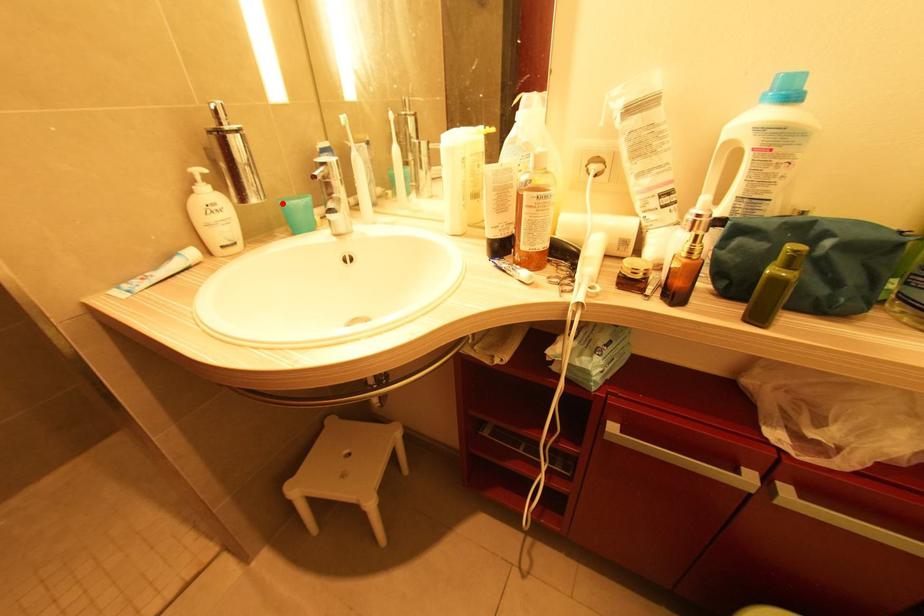
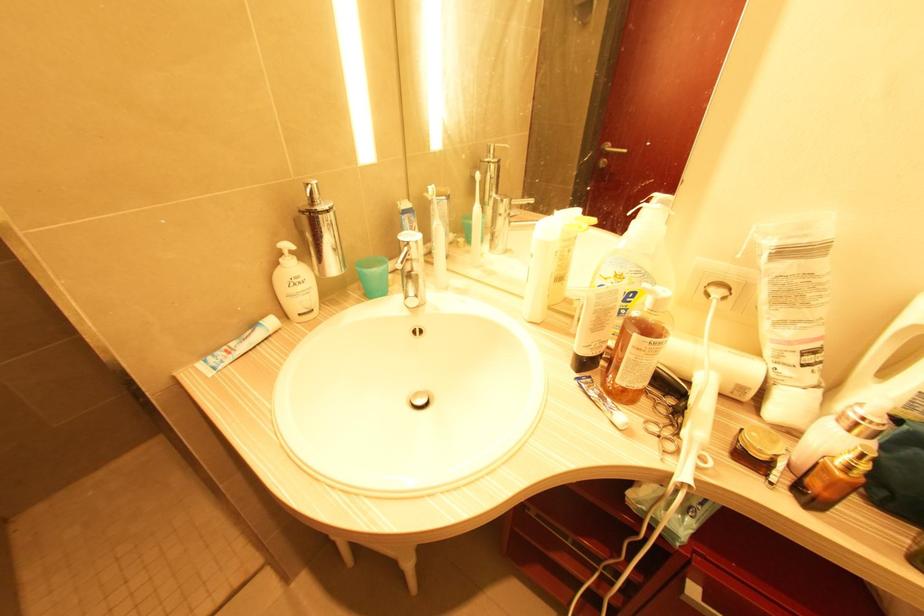
Locate, in the second image, the point that corresponds to the highlighted location in the first image.

(359, 270)